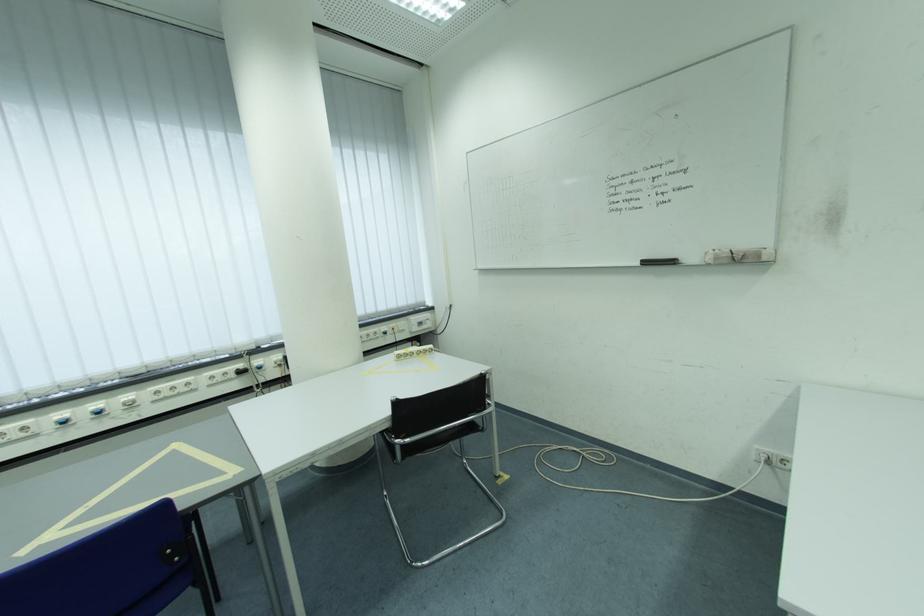
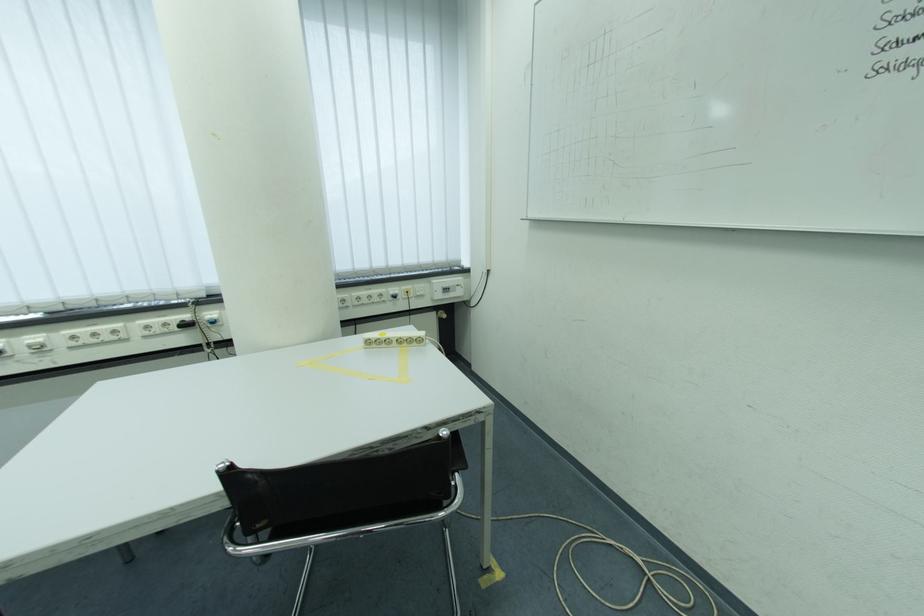
Where in the second image is the point corresponding to (x=429, y=326) from the first image?

(455, 292)